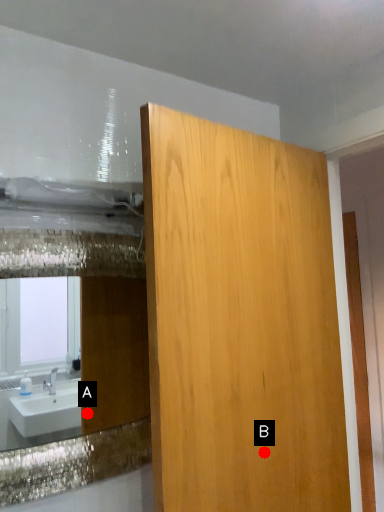
Question: Two points are circled on the image, labeled by A and B beside each circle. Which point is further to the camera?

Choices:
 (A) A is further
 (B) B is further

Answer: (A)